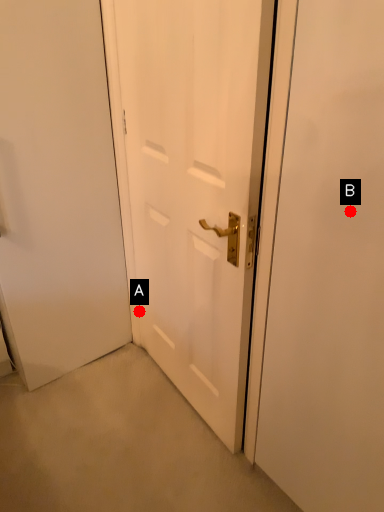
Question: Two points are circled on the image, labeled by A and B beside each circle. Which point appears farthest from the camera in this image?

Choices:
 (A) A is further
 (B) B is further

Answer: (A)